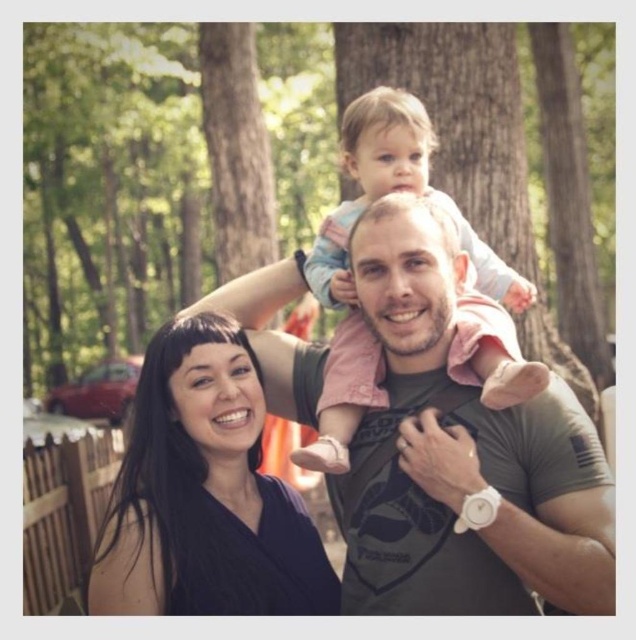
Is black matte hair at center shorter than light pink fabric at center?

Yes.

Looking at this image, is black matte hair at center to the right of light pink fabric at center from the viewer's perspective?

Incorrect, black matte hair at center is not on the right side of light pink fabric at center.

The height and width of the screenshot is (640, 636). Describe the element at coordinates (204, 493) in the screenshot. I see `black matte hair at center` at that location.

The height and width of the screenshot is (640, 636). I want to click on black matte hair at center, so click(204, 493).

Does matte gray shirt at center have a smaller size compared to light pink fabric at center?

Correct, matte gray shirt at center occupies less space than light pink fabric at center.

Does matte gray shirt at center lie in front of light pink fabric at center?

No, matte gray shirt at center is behind light pink fabric at center.

Does point (387, 234) lie behind point (480, 253)?

That is False.

Where is `matte gray shirt at center`? The height and width of the screenshot is (640, 636). matte gray shirt at center is located at coordinates (466, 460).

Who is positioned more to the right, matte gray shirt at center or black matte hair at center?

matte gray shirt at center

Locate an element on the screen. The image size is (636, 640). matte gray shirt at center is located at coordinates (466, 460).

The image size is (636, 640). In order to click on matte gray shirt at center in this screenshot , I will do `click(466, 460)`.